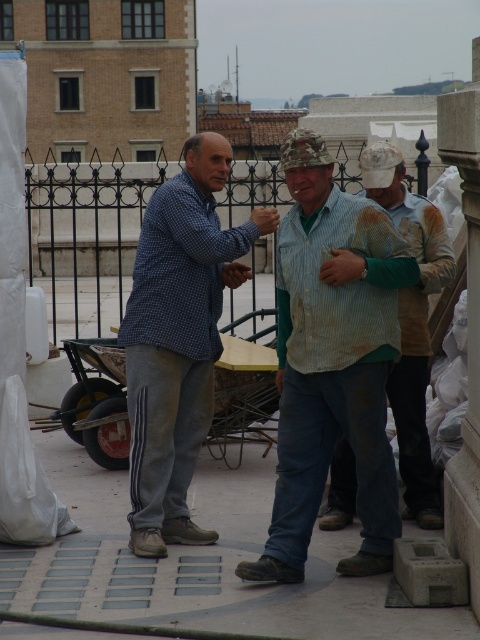
Question: Which of the following is the closest to the observer?

Choices:
 (A) blue checkered shirt at center
 (B) rusty metal shirt at center

Answer: (A)

Question: Considering the relative positions of striped cotton shirt at center and rusty metal shirt at center in the image provided, where is striped cotton shirt at center located with respect to rusty metal shirt at center?

Choices:
 (A) left
 (B) right

Answer: (A)

Question: Which of these objects is positioned closest to the striped cotton shirt at center?

Choices:
 (A) rusty metal shirt at center
 (B) blue checkered shirt at center

Answer: (A)

Question: Which point is closer to the camera?

Choices:
 (A) blue checkered shirt at center
 (B) striped cotton shirt at center

Answer: (B)

Question: Does striped cotton shirt at center lie behind blue checkered shirt at center?

Choices:
 (A) yes
 (B) no

Answer: (B)

Question: Does striped cotton shirt at center appear under blue checkered shirt at center?

Choices:
 (A) no
 (B) yes

Answer: (B)